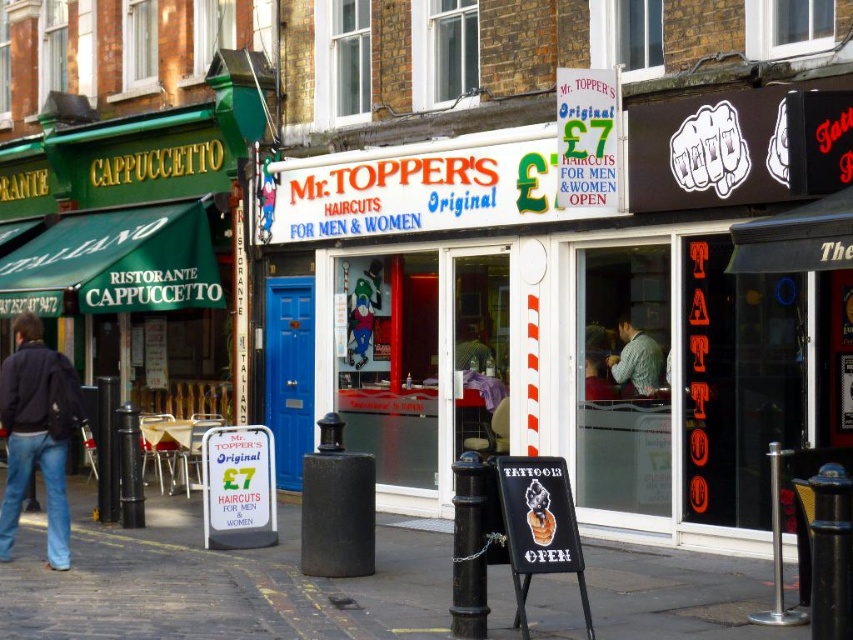
From the picture: Can you confirm if smooth concrete pavement at center is positioned to the right of dark blue jacket at lower left?

Indeed, smooth concrete pavement at center is positioned on the right side of dark blue jacket at lower left.

Which is behind, point (190, 592) or point (68, 515)?

Positioned behind is point (68, 515).

Locate an element on the screen. The width and height of the screenshot is (853, 640). smooth concrete pavement at center is located at coordinates (219, 584).

Which of these two, smooth concrete pavement at center or knitted green sweater at center, stands shorter?

smooth concrete pavement at center

Between point (618, 577) and point (637, 332), which one is positioned in front?

Point (618, 577) is in front.

Does point (32, 536) come behind point (653, 365)?

That is True.

Locate an element on the screen. The width and height of the screenshot is (853, 640). smooth concrete pavement at center is located at coordinates (219, 584).

Is point (6, 484) farther from camera compared to point (631, 348)?

No, it is in front of (631, 348).

Between dark blue jacket at lower left and knitted green sweater at center, which one appears on the left side from the viewer's perspective?

Positioned to the left is dark blue jacket at lower left.

Is point (7, 472) positioned in front of point (627, 330)?

Yes, point (7, 472) is closer to viewer.

Locate an element on the screen. dark blue jacket at lower left is located at coordinates (33, 436).